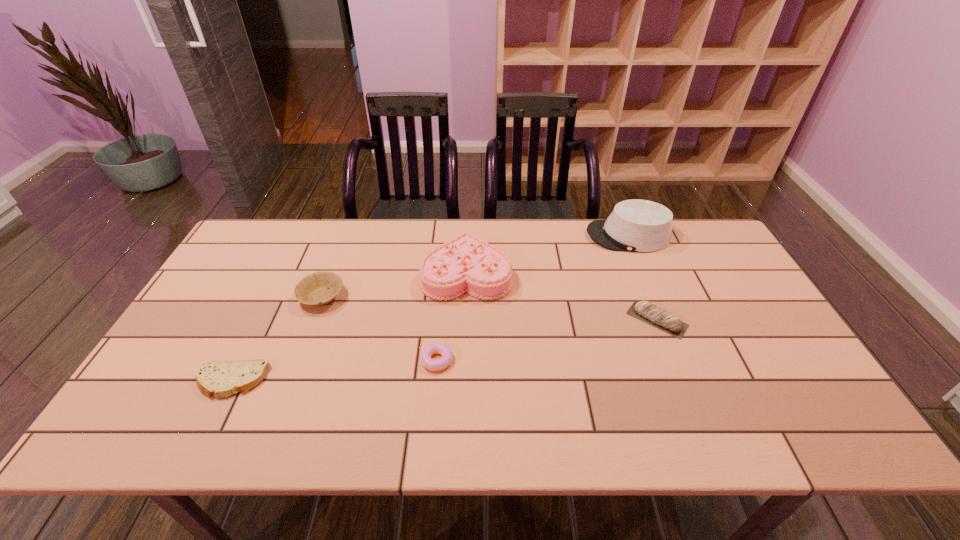
At what (x,y) coordinates should I click in order to perform the action: click on free point between the bowl and the doughnut. Please return your answer as a coordinate pair (x, y). The image size is (960, 540). Looking at the image, I should click on (379, 328).

Where is `free spot between the shorter pita bread and the bowl`? This screenshot has height=540, width=960. free spot between the shorter pita bread and the bowl is located at coordinates (276, 339).

Identify the location of free spot between the tallest object and the doughnut. This screenshot has height=540, width=960. (533, 298).

The image size is (960, 540). What are the coordinates of `free spot between the doughnut and the tallest object` in the screenshot? It's located at (533, 298).

Locate an element on the screen. This screenshot has height=540, width=960. free space between the right pita bread and the second tallest object is located at coordinates (562, 296).

I want to click on free space between the cake and the doughnut, so click(452, 316).

Find the location of a particular element. The height and width of the screenshot is (540, 960). object that is the fifth closest to the cake is located at coordinates (215, 378).

Select which object is the third closest to the farther pita bread. Please provide its 2D coordinates. Your answer should be formatted as a tuple, i.e. [(x, y)], where the tuple contains the x and y coordinates of a point satisfying the conditions above.

[(434, 348)]

Locate an element on the screen. The width and height of the screenshot is (960, 540). vacant area that satisfies the following two spatial constraints: 1. on the back side of the nearer pita bread; 2. on the left side of the doughnut is located at coordinates (242, 360).

Where is `free region that satisfies the following two spatial constraints: 1. on the front-facing side of the hat; 2. on the front side of the farther pita bread`? free region that satisfies the following two spatial constraints: 1. on the front-facing side of the hat; 2. on the front side of the farther pita bread is located at coordinates (663, 320).